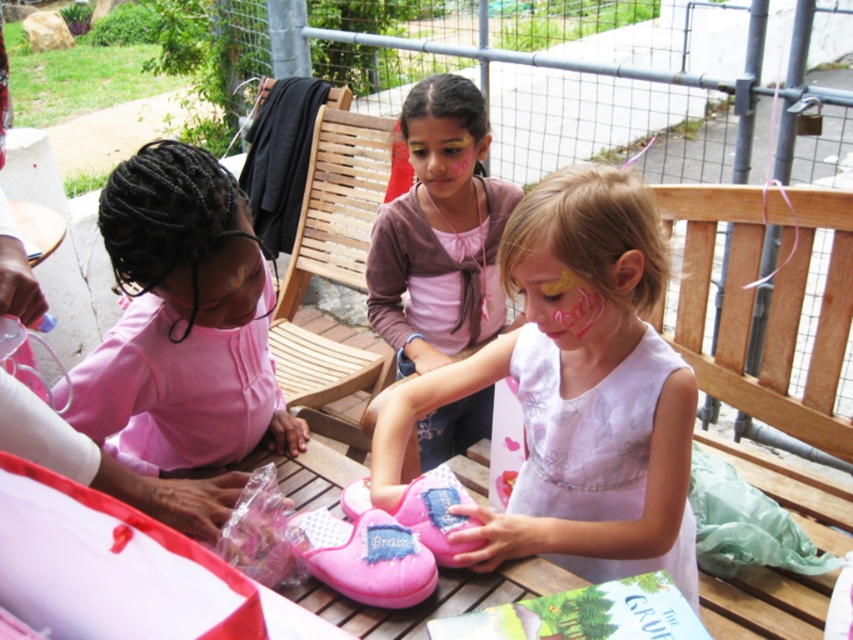
Is pink satin dress at left taller than pastel pink face paint at center?

Correct, pink satin dress at left is much taller as pastel pink face paint at center.

Is pink satin dress at left above pastel pink face paint at center?

Actually, pink satin dress at left is below pastel pink face paint at center.

The height and width of the screenshot is (640, 853). I want to click on pink satin dress at left, so click(183, 321).

Is pastel pink face paint at center further to the viewer compared to matte pink face paint at center?

No, it is in front of matte pink face paint at center.

Which is more to the right, pastel pink face paint at center or matte pink face paint at center?

From the viewer's perspective, pastel pink face paint at center appears more on the right side.

Image resolution: width=853 pixels, height=640 pixels. In order to click on pastel pink face paint at center in this screenshot , I will do `click(566, 305)`.

Does point (543, 397) come closer to viewer compared to point (558, 307)?

No, it is behind (558, 307).

Which is above, pink fabric shoes at center or pastel pink face paint at center?

Positioned higher is pastel pink face paint at center.

I want to click on pink fabric shoes at center, so click(x=576, y=392).